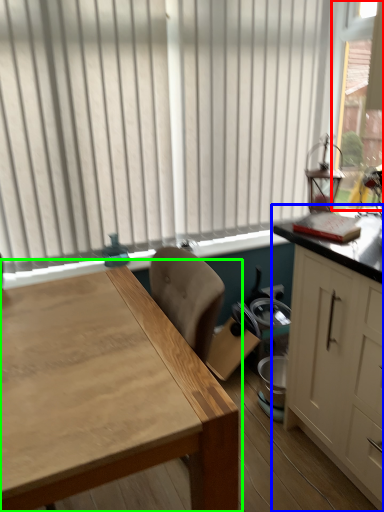
Question: Considering the real-world distances, which object is farthest from window screen (highlighted by a red box)? cabinetry (highlighted by a blue box) or table (highlighted by a green box)?

Choices:
 (A) cabinetry
 (B) table

Answer: (B)